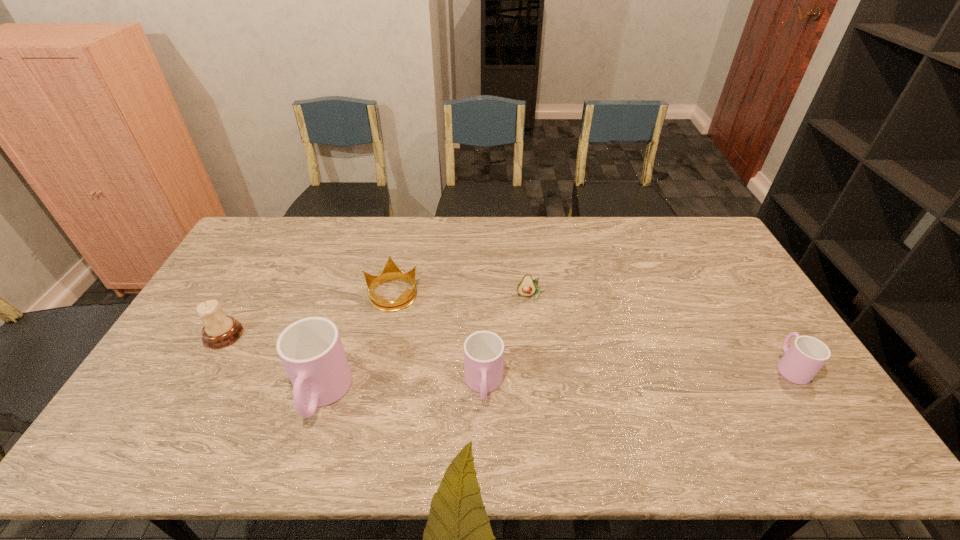
Identify the location of free area in between the crown and the avocado. This screenshot has width=960, height=540. (462, 295).

Select which object is the fifth closest to the avocado. Please provide its 2D coordinates. Your answer should be formatted as a tuple, i.e. [(x, y)], where the tuple contains the x and y coordinates of a point satisfying the conditions above.

[(219, 331)]

Identify which object is the fourth closest to the third object from right to left. Please provide its 2D coordinates. Your answer should be formatted as a tuple, i.e. [(x, y)], where the tuple contains the x and y coordinates of a point satisfying the conditions above.

[(219, 331)]

Locate which cup ranks in proximity to the avocado. Please provide its 2D coordinates. Your answer should be formatted as a tuple, i.e. [(x, y)], where the tuple contains the x and y coordinates of a point satisfying the conditions above.

[(483, 350)]

Identify which cup is located as the third nearest to the leftmost object. Please provide its 2D coordinates. Your answer should be formatted as a tuple, i.e. [(x, y)], where the tuple contains the x and y coordinates of a point satisfying the conditions above.

[(805, 357)]